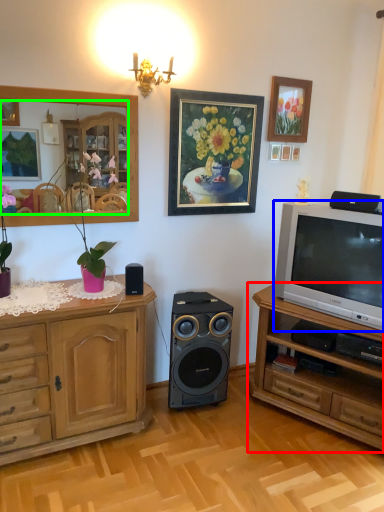
Question: Which is farther away from chest of drawers (highlighted by a red box)? television (highlighted by a blue box) or mirror (highlighted by a green box)?

Choices:
 (A) television
 (B) mirror

Answer: (B)